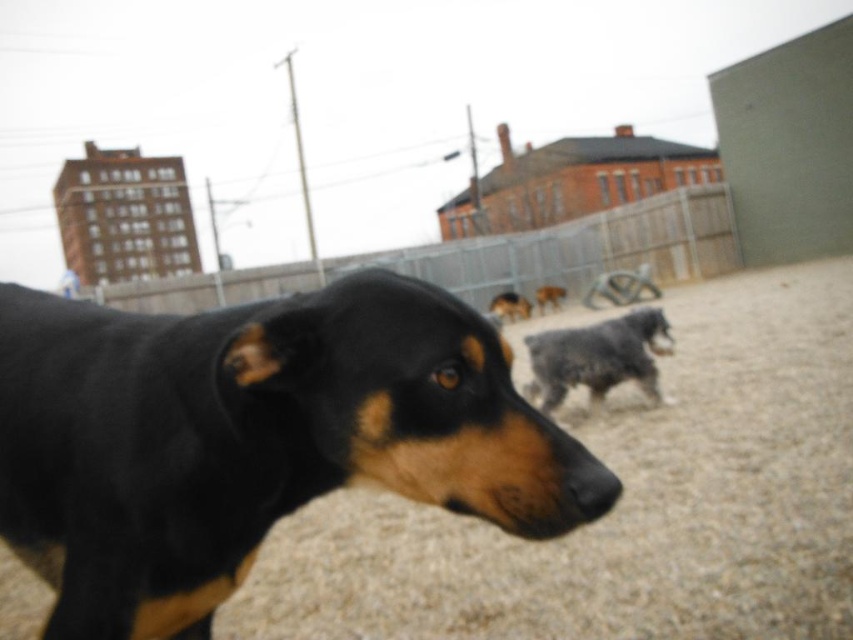
You are standing in the fenced enclosure looking at the black and tan dog and the other dogs. There are two points marked in the image. The first point is at coordinates point [727,296] and the second point is at point [541,342]. Which point is closer to you?

Point [727,296] is further to the viewer than point [541,342], so the second point is closer to you.

You are a dog owner who wants to know if your fuzzy gray dog at center can easily walk over the brown gravel at center. Based on the scene description, can you determine if the gravel is higher than your dog?

The brown gravel at center has a greater height compared to fuzzy gray dog at center, so the gravel is higher than the dog. This means the dog may have difficulty walking over it due to the height difference.